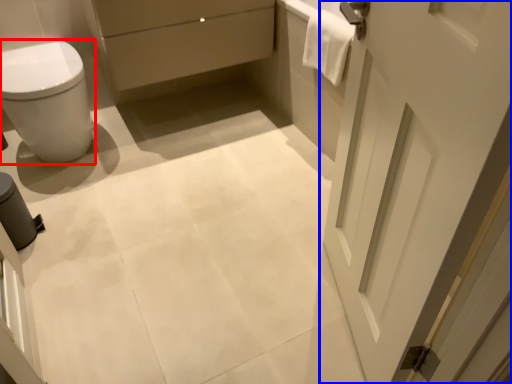
Question: Which point is closer to the camera, bidet (highlighted by a red box) or door (highlighted by a blue box)?

Choices:
 (A) bidet
 (B) door

Answer: (B)